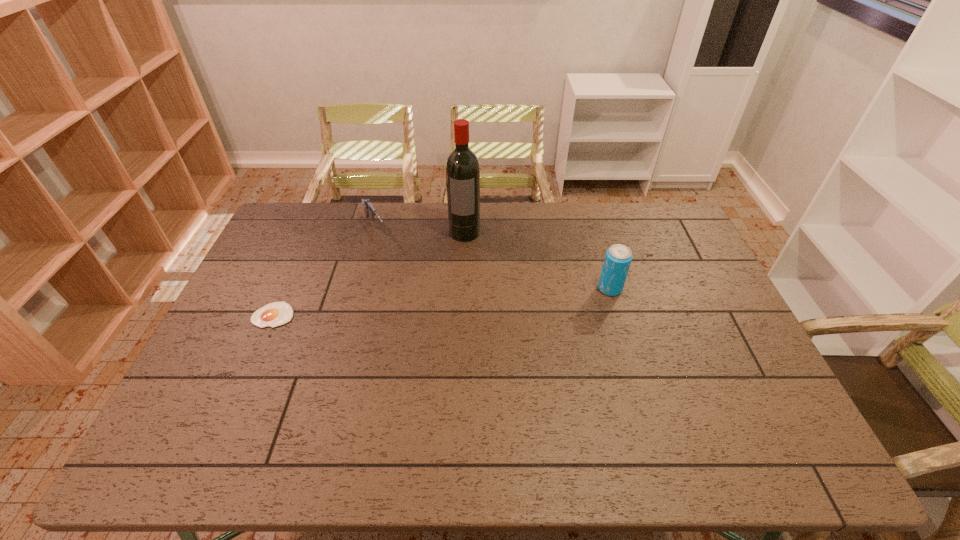
The width and height of the screenshot is (960, 540). I want to click on the leftmost object, so click(274, 314).

This screenshot has height=540, width=960. Find the location of `the nearest object`. the nearest object is located at coordinates (274, 314).

Locate an element on the screen. The width and height of the screenshot is (960, 540). the third shortest object is located at coordinates (618, 258).

You are a GUI agent. You are given a task and a screenshot of the screen. Output one action in this format:
    pyautogui.click(x=<x>, y=<y>)
    Task: Click on the rightmost object
    The width and height of the screenshot is (960, 540).
    Given the screenshot: What is the action you would take?
    click(x=618, y=258)

Image resolution: width=960 pixels, height=540 pixels. I want to click on the tallest object, so click(x=462, y=166).

At what (x,y) coordinates should I click in order to perform the action: click on the third object from left to right. Please return your answer as a coordinate pair (x, y). The height and width of the screenshot is (540, 960). Looking at the image, I should click on [462, 166].

You are a GUI agent. You are given a task and a screenshot of the screen. Output one action in this format:
    pyautogui.click(x=<x>, y=<y>)
    Task: Click on the third tallest object
    This screenshot has height=540, width=960.
    Given the screenshot: What is the action you would take?
    pyautogui.click(x=369, y=210)

Where is `gun`? gun is located at coordinates coord(369,210).

At what (x,y) coordinates should I click in order to perform the action: click on vacant space situated 0.300m on the back of the nearest object. Please return your answer as a coordinate pair (x, y). The height and width of the screenshot is (540, 960). Looking at the image, I should click on (306, 240).

Locate an element on the screen. vacant area situated on the back of the soda can is located at coordinates 600,256.